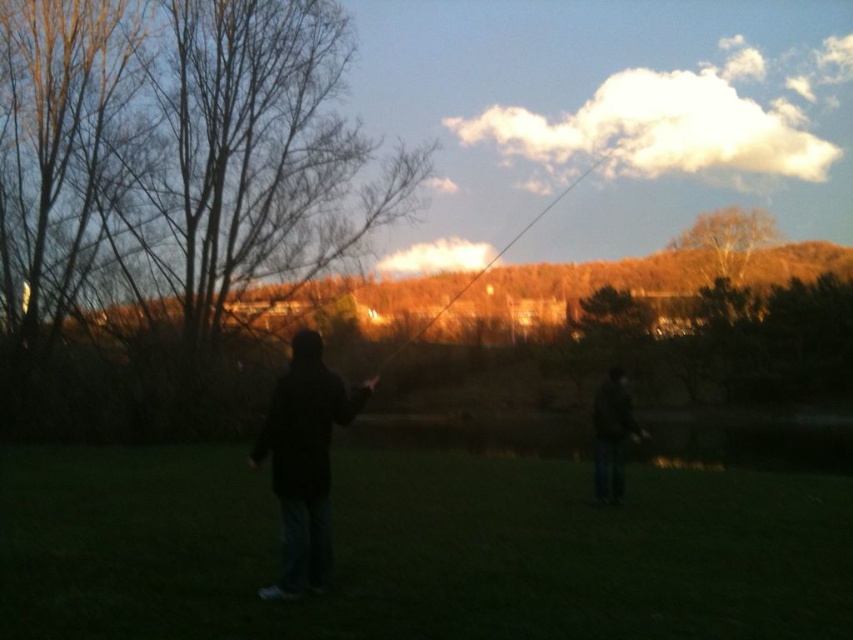
Can you confirm if black matte jacket at center is shorter than smooth wooden rod at upper center?

Correct, black matte jacket at center is not as tall as smooth wooden rod at upper center.

Is point (280, 420) less distant than point (433, 320)?

That is True.

Identify the location of black matte jacket at center. The image size is (853, 640). (305, 461).

Who is positioned more to the right, brown leafy tree at upper center or dark gray jacket at lower right?

brown leafy tree at upper center

Is point (705, 275) more distant than point (596, 416)?

That is True.

This screenshot has width=853, height=640. Identify the location of brown leafy tree at upper center. (724, 241).

Is point (622, 490) farther from camera compared to point (370, 378)?

Yes.

From the picture: Does dark gray jacket at lower right have a lesser width compared to smooth wooden rod at upper center?

Indeed, dark gray jacket at lower right has a lesser width compared to smooth wooden rod at upper center.

Measure the distance between dark gray jacket at lower right and camera.

dark gray jacket at lower right and camera are 38.07 feet apart.

At what (x,y) coordinates should I click in order to perform the action: click on dark gray jacket at lower right. Please return your answer as a coordinate pair (x, y). The image size is (853, 640). Looking at the image, I should click on (612, 435).